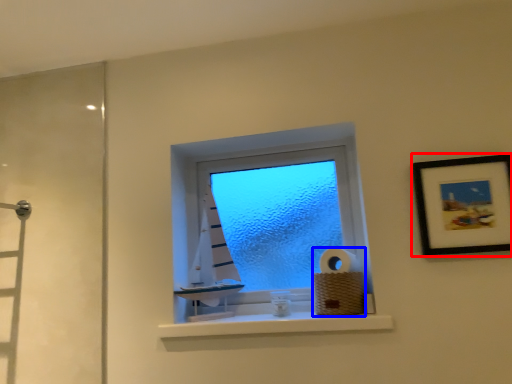
Question: Which of the following is the closest to the observer, picture frame (highlighted by a red box) or toilet paper (highlighted by a blue box)?

Choices:
 (A) picture frame
 (B) toilet paper

Answer: (A)